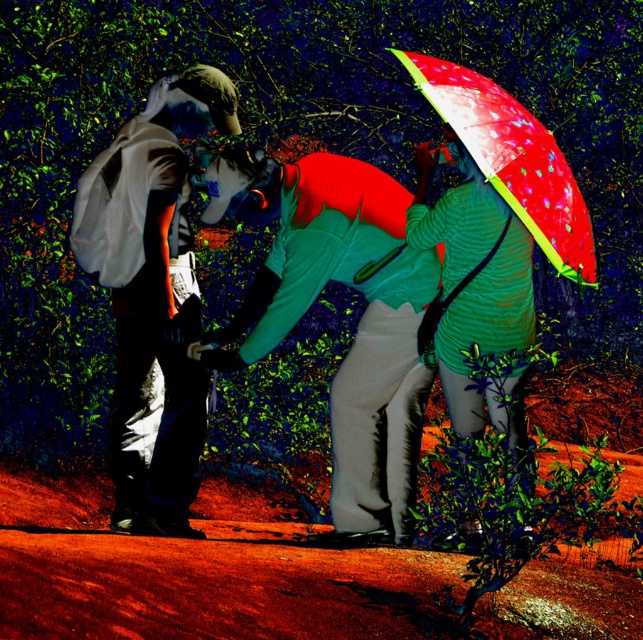
Is matte green umbrella at upper right to the right of green striped sweater at center from the viewer's perspective?

No, matte green umbrella at upper right is not to the right of green striped sweater at center.

Is matte green umbrella at upper right taller than green striped sweater at center?

Yes.

Does point (140, 129) come closer to viewer compared to point (467, 177)?

That is False.

The image size is (643, 640). In order to click on matte green umbrella at upper right in this screenshot , I will do tap(359, 323).

Image resolution: width=643 pixels, height=640 pixels. What do you see at coordinates (152, 296) in the screenshot?
I see `matte white jacket at left` at bounding box center [152, 296].

Does matte white jacket at left lie in front of green striped sweater at center?

No, matte white jacket at left is further to the viewer.

Which is in front, point (120, 392) or point (439, 355)?

Point (439, 355) is more forward.

The image size is (643, 640). I want to click on matte white jacket at left, so click(152, 296).

Does matte green umbrella at upper right appear over matte white jacket at left?

No, matte green umbrella at upper right is not above matte white jacket at left.

Between matte green umbrella at upper right and matte white jacket at left, which one has more height?

With more height is matte white jacket at left.

What do you see at coordinates (359, 323) in the screenshot?
I see `matte green umbrella at upper right` at bounding box center [359, 323].

You are a GUI agent. You are given a task and a screenshot of the screen. Output one action in this format:
    pyautogui.click(x=<x>, y=<y>)
    Task: Click on the matte green umbrella at upper right
    Image resolution: width=643 pixels, height=640 pixels.
    Given the screenshot: What is the action you would take?
    pyautogui.click(x=359, y=323)